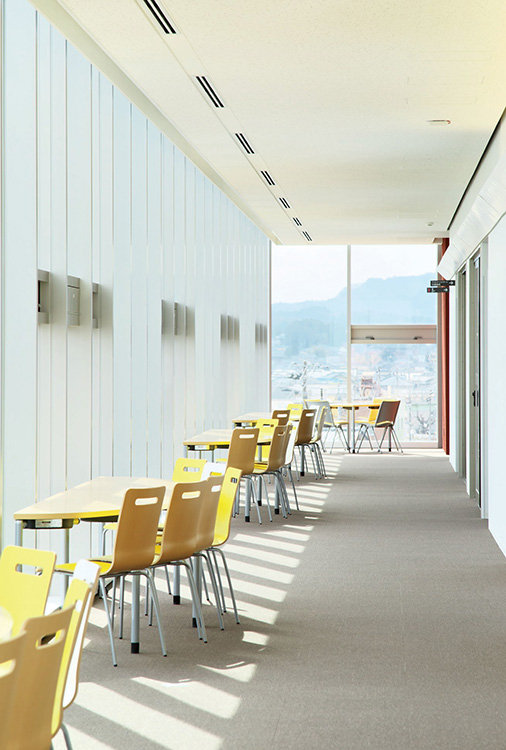
Where is `tables`? tables is located at coordinates (6, 621), (91, 498), (214, 435), (254, 416), (348, 402).